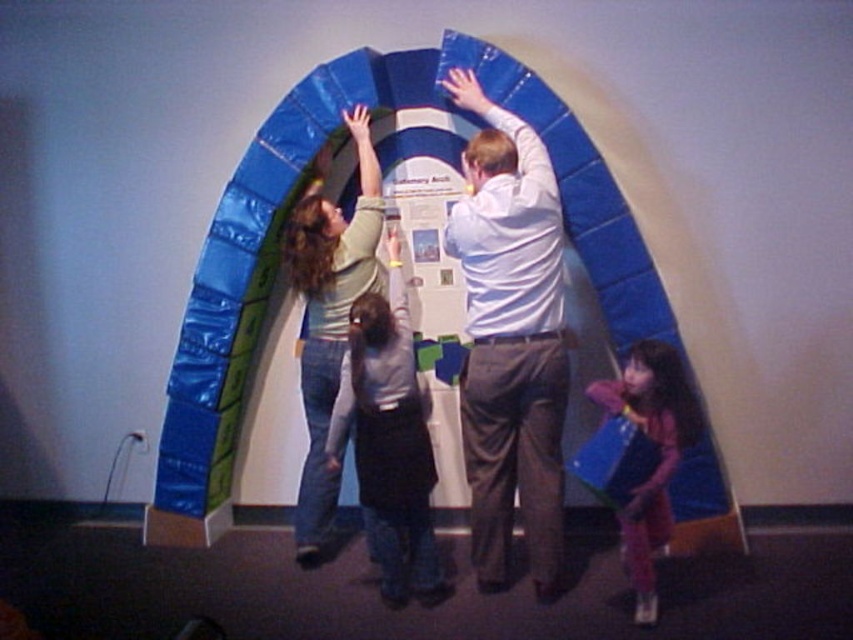
You are a photographer trying to capture a photo of the matte gray sweater at center and the matte pink dress at lower right. Which one should you focus on first if you want to ensure both are in focus without adjusting the camera settings?

The matte gray sweater at center is taller than the matte pink dress at lower right. Focus on the matte gray sweater at center first since it is closer to the camera, ensuring both will be in focus with a single focal point.

You are organizing a photoshoot and need to know the relative sizes of the clothing items in the scene. Which clothing item is wider, the matte gray sweater at center or the matte pink dress at lower right?

The matte gray sweater at center is wider than the matte pink dress at lower right according to the description.

You are a photographer trying to capture a photo of the matte green shirt at center and the matte pink dress at lower right. Which subject should you focus on first if you want to ensure both are in focus without adjusting the camera settings?

The matte green shirt at center is taller than the matte pink dress at lower right, so focusing on the matte green shirt at center first will help ensure both are in focus since it is closer to the camera.